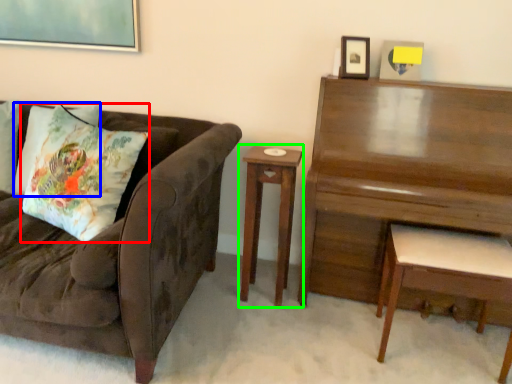
Question: Which object is positioned closest to throw pillow (highlighted by a red box)? Select from pillow (highlighted by a blue box) and nightstand (highlighted by a green box).

Choices:
 (A) pillow
 (B) nightstand

Answer: (A)